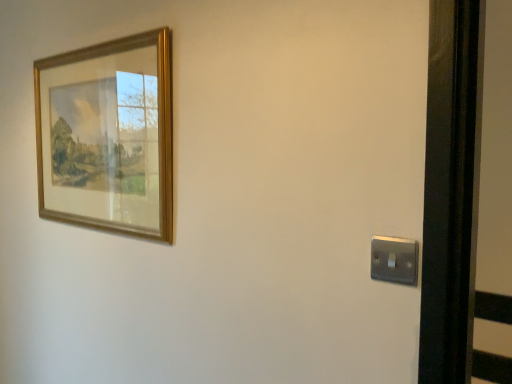
Measure the distance between point [42,217] and camera.

A distance of 5.27 feet exists between point [42,217] and camera.

This screenshot has height=384, width=512. I want to click on wooden picture frame at upper left, so click(x=108, y=136).

What do you see at coordinates (108, 136) in the screenshot? The height and width of the screenshot is (384, 512). I see `wooden picture frame at upper left` at bounding box center [108, 136].

The height and width of the screenshot is (384, 512). I want to click on satin silver switch at lower right, so click(394, 260).

What do you see at coordinates (394, 260) in the screenshot? I see `satin silver switch at lower right` at bounding box center [394, 260].

This screenshot has width=512, height=384. In order to click on wooden picture frame at upper left in this screenshot , I will do `click(108, 136)`.

Is wooden picture frame at upper left at the left side of satin silver switch at lower right?

Yes.

Is wooden picture frame at upper left positioned behind satin silver switch at lower right?

Yes, wooden picture frame at upper left is further from the viewer.

Does point (123, 94) come closer to viewer compared to point (382, 238)?

No, it is not.

From the image's perspective, between wooden picture frame at upper left and satin silver switch at lower right, which one is located above?

From the image's view, wooden picture frame at upper left is above.

From a real-world perspective, does wooden picture frame at upper left stand above satin silver switch at lower right?

Yes.

Which of these two, wooden picture frame at upper left or satin silver switch at lower right, is thinner?

satin silver switch at lower right is thinner.

Between wooden picture frame at upper left and satin silver switch at lower right, which one has less height?

satin silver switch at lower right is shorter.

Between wooden picture frame at upper left and satin silver switch at lower right, which one has smaller size?

satin silver switch at lower right is smaller.

Is wooden picture frame at upper left situated inside satin silver switch at lower right or outside?

wooden picture frame at upper left is not inside satin silver switch at lower right, it's outside.

Is wooden picture frame at upper left in contact with satin silver switch at lower right?

No, wooden picture frame at upper left is not in contact with satin silver switch at lower right.

Is satin silver switch at lower right at the back of wooden picture frame at upper left?

wooden picture frame at upper left is not turned away from satin silver switch at lower right.

How distant is wooden picture frame at upper left from satin silver switch at lower right?

A distance of 35.80 inches exists between wooden picture frame at upper left and satin silver switch at lower right.

You are a GUI agent. You are given a task and a screenshot of the screen. Output one action in this format:
    pyautogui.click(x=<x>, y=<y>)
    Task: Click on the picture frame above the satin silver switch at lower right (from the image's perspective)
    The image size is (512, 384).
    Given the screenshot: What is the action you would take?
    pyautogui.click(x=108, y=136)

Which object is positioned more to the right, satin silver switch at lower right or wooden picture frame at upper left?

From the viewer's perspective, satin silver switch at lower right appears more on the right side.

Looking at this image, between satin silver switch at lower right and wooden picture frame at upper left, which one is positioned in front?

satin silver switch at lower right.

Is point (376, 276) less distant than point (154, 114)?

Yes, point (376, 276) is closer to viewer.

From the image's perspective, which one is positioned higher, satin silver switch at lower right or wooden picture frame at upper left?

wooden picture frame at upper left.

From a real-world perspective, does satin silver switch at lower right stand above wooden picture frame at upper left?

Actually, satin silver switch at lower right is physically below wooden picture frame at upper left in the real world.

Can you confirm if satin silver switch at lower right is thinner than wooden picture frame at upper left?

Yes.

Between satin silver switch at lower right and wooden picture frame at upper left, which one has more height?

Standing taller between the two is wooden picture frame at upper left.

Does satin silver switch at lower right have a larger size compared to wooden picture frame at upper left?

No, satin silver switch at lower right is not bigger than wooden picture frame at upper left.

Can we say satin silver switch at lower right lies outside wooden picture frame at upper left?

Yes, satin silver switch at lower right is not within wooden picture frame at upper left.

Is there a large distance between satin silver switch at lower right and wooden picture frame at upper left?

No, there isn't a large distance between satin silver switch at lower right and wooden picture frame at upper left.

Is satin silver switch at lower right facing towards wooden picture frame at upper left?

No, satin silver switch at lower right is not facing towards wooden picture frame at upper left.

What's the angular difference between satin silver switch at lower right and wooden picture frame at upper left's facing directions?

The angle between the facing direction of satin silver switch at lower right and the facing direction of wooden picture frame at upper left is 0.131 degrees.

Measure the distance between satin silver switch at lower right and wooden picture frame at upper left.

satin silver switch at lower right and wooden picture frame at upper left are 90.94 centimeters apart.

Identify the location of light switch that appears below the wooden picture frame at upper left (from the image's perspective). Image resolution: width=512 pixels, height=384 pixels. (394, 260).

Image resolution: width=512 pixels, height=384 pixels. Find the location of `light switch to the right of wooden picture frame at upper left`. light switch to the right of wooden picture frame at upper left is located at coordinates (394, 260).

This screenshot has height=384, width=512. What are the coordinates of `light switch in front of the wooden picture frame at upper left` in the screenshot? It's located at (394, 260).